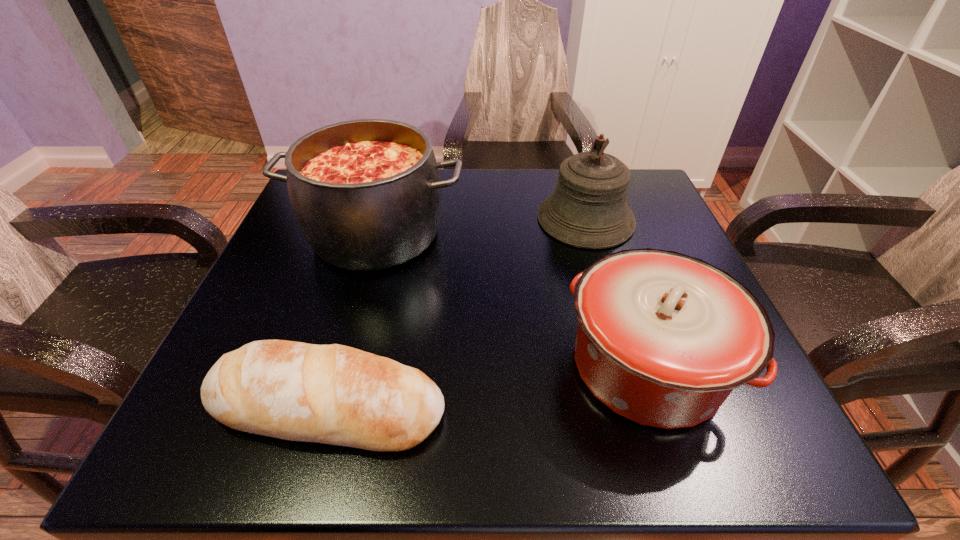
Identify the location of free space between the bell and the bread. The height and width of the screenshot is (540, 960). (457, 313).

Find the location of a particular element. The height and width of the screenshot is (540, 960). vacant point located between the left casserole and the nearer casserole is located at coordinates (x=512, y=300).

You are a GUI agent. You are given a task and a screenshot of the screen. Output one action in this format:
    pyautogui.click(x=<x>, y=<y>)
    Task: Click on the free spot between the shorter casserole and the farther casserole
    This screenshot has width=960, height=540.
    Given the screenshot: What is the action you would take?
    pyautogui.click(x=512, y=300)

The image size is (960, 540). I want to click on free space that is in between the bread and the farther casserole, so click(x=352, y=320).

Locate an element on the screen. Image resolution: width=960 pixels, height=540 pixels. vacant area that lies between the left casserole and the bread is located at coordinates [x=352, y=320].

Locate an element on the screen. object that stands as the second closest to the bell is located at coordinates (366, 193).

Locate an element on the screen. This screenshot has width=960, height=540. object that stands as the third closest to the bread is located at coordinates click(588, 209).

Locate an element on the screen. Image resolution: width=960 pixels, height=540 pixels. vacant point that satisfies the following two spatial constraints: 1. on the back side of the taller casserole; 2. on the left side of the bell is located at coordinates (380, 219).

Identify the location of blank space that satisfies the following two spatial constraints: 1. on the back side of the second shortest object; 2. on the left side of the shortest object. The height and width of the screenshot is (540, 960). (340, 366).

Identify the location of free space that satisfies the following two spatial constraints: 1. on the back side of the shorter casserole; 2. on the left side of the shortest object. (340, 366).